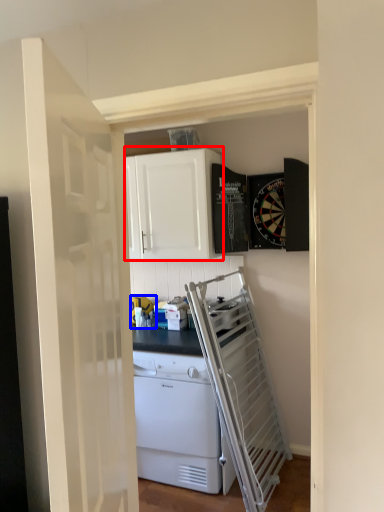
Question: Among these objects, which one is farthest to the camera, cabinetry (highlighted by a red box) or appliance (highlighted by a blue box)?

Choices:
 (A) cabinetry
 (B) appliance

Answer: (B)